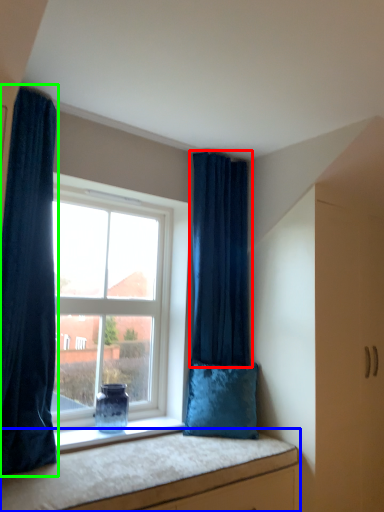
Question: Which is nearer to the curtain (highlighted by a red box)? vanity (highlighted by a blue box) or curtain (highlighted by a green box).

Choices:
 (A) vanity
 (B) curtain

Answer: (A)